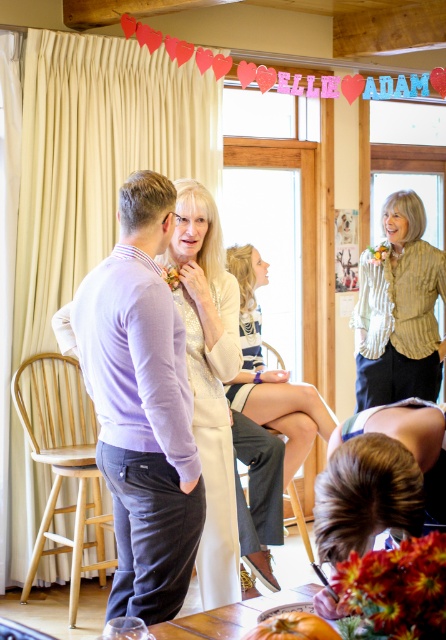
You are standing in the room and want to greet the person in the white textured dress at center. Based on their position in the room, in which general direction should you walk to approach them?

The white textured dress at center is located at the central area of the room, so you should walk towards the center of the room to approach them.

You are a photographer at this event and need to capture a photo of both the purple fabric shirt at left and the white textured dress at center. The camera you are using has a minimum focus distance of 2 centimeters. Will you be able to get both subjects in focus without moving either of them?

The purple fabric shirt at left and white textured dress at center are 2.15 centimeters apart, which is just over the camera minimum focus distance of 2 centimeters. Therefore, you can capture both subjects in focus without moving them.

You are a photographer at the event and want to capture a photo that includes both the white textured dress at center and the green striped shirt at upper right. Based on their positions, which object should be placed on the left side of the photo frame?

The white textured dress at center should be placed on the left side of the photo frame because it is positioned on the left side of the green striped shirt at upper right.